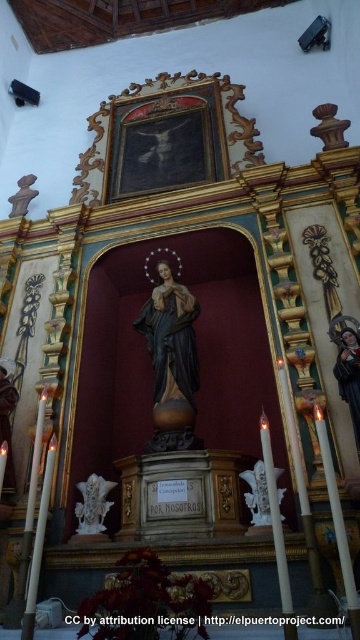
Question: Can you confirm if matte brown statue at center is positioned to the left of smooth skin figure at center?

Choices:
 (A) no
 (B) yes

Answer: (B)

Question: Estimate the real-world distances between objects in this image. Which object is farther from the matte brown statue at center?

Choices:
 (A) white marble statue at center
 (B) smooth skin figure at center
 (C) white marble statue at lower left

Answer: (B)

Question: Which of the following is the closest to the observer?

Choices:
 (A) (353, 333)
 (B) (92, 516)

Answer: (A)

Question: Is matte brown statue at center positioned before white marble statue at center?

Choices:
 (A) yes
 (B) no

Answer: (B)

Question: Which object is the farthest from the smooth skin figure at center?

Choices:
 (A) white marble statue at lower left
 (B) matte brown statue at center

Answer: (A)

Question: Observing the image, what is the correct spatial positioning of white marble statue at lower left in reference to white marble statue at center?

Choices:
 (A) below
 (B) above

Answer: (A)